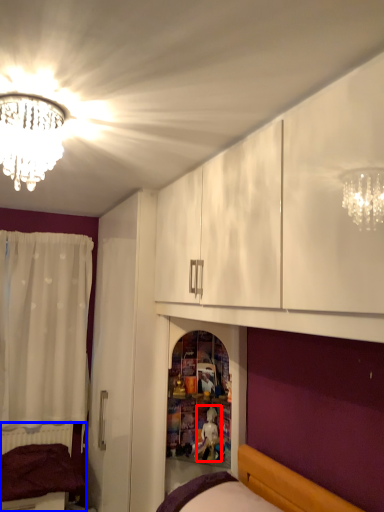
Question: Among these objects, which one is nearest to the camera, toy (highlighted by a red box) or bed (highlighted by a blue box)?

Choices:
 (A) toy
 (B) bed

Answer: (A)